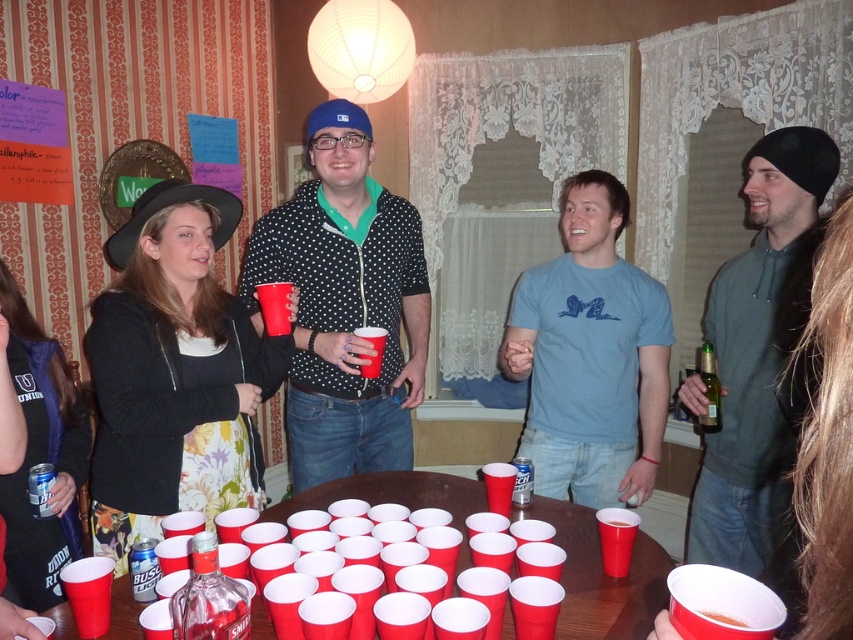
You are a guest at this party and want to grab a drink from the smooth plastic cups at center without moving your feet. Can you reach them if you are currently standing next to the gray hoodie at right?

The distance between the gray hoodie at right and the smooth plastic cups at center is 27.70 inches, so if you are standing next to the gray hoodie at right, you can likely reach the cups at center as 27.70 inches is within typical human reaching distance.

You are organizing a charity event and need to decide which item to place in a 1.2 meter wide display case. The polka dot shirt at center and the clear glass bottle at lower left are both candidates. Based on their sizes, which one will fit better in the case?

The polka dot shirt at center is wider than the clear glass bottle at lower left, so it will fit better in the 1.2 meter wide display case.